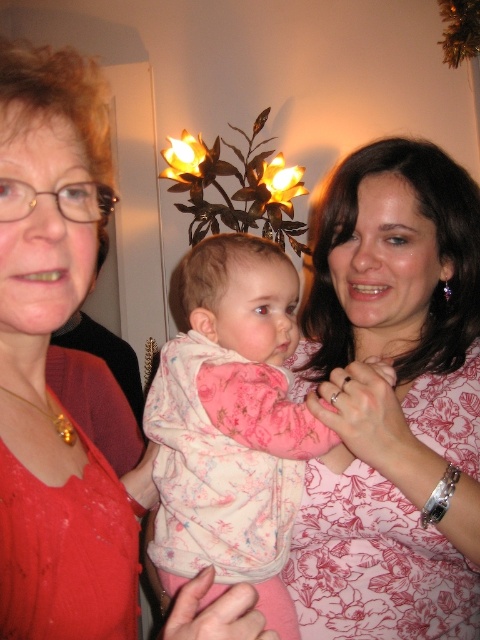
Which of these two, floral pink blouse at center or pink floral dress at center, stands shorter?

With less height is pink floral dress at center.

This screenshot has height=640, width=480. Identify the location of floral pink blouse at center. (392, 401).

You are a GUI agent. You are given a task and a screenshot of the screen. Output one action in this format:
    pyautogui.click(x=<x>, y=<y>)
    Task: Click on the floral pink blouse at center
    The width and height of the screenshot is (480, 640).
    Given the screenshot: What is the action you would take?
    pyautogui.click(x=392, y=401)

Between pink floral dress at center and fluffy pink pajamas at center, which one appears on the left side from the viewer's perspective?

pink floral dress at center is more to the left.

Which is in front, point (85, 532) or point (194, 512)?

Point (85, 532)

Identify the location of pink floral dress at center. The image size is (480, 640). (45, 362).

Between floral pink blouse at center and fluffy pink pajamas at center, which one appears on the right side from the viewer's perspective?

From the viewer's perspective, floral pink blouse at center appears more on the right side.

Who is positioned more to the left, floral pink blouse at center or fluffy pink pajamas at center?

Positioned to the left is fluffy pink pajamas at center.

Is point (459, 378) closer to camera compared to point (201, 502)?

No.

Where is `floral pink blouse at center`? The height and width of the screenshot is (640, 480). floral pink blouse at center is located at coordinates (392, 401).